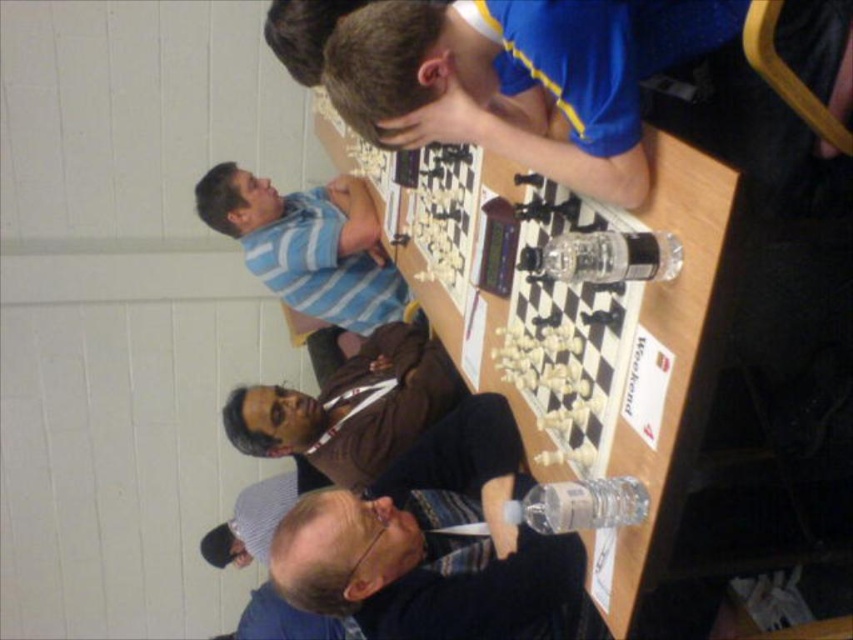
You are a photographer standing at the back of the room. You want to take a photo of the blue jersey at upper center and the blue striped shirt at upper left. The camera you are using has a minimum focus distance of 1.5 meters. Will you be able to capture both subjects clearly in the same frame without moving closer?

The distance between the blue jersey at upper center and the blue striped shirt at upper left is 1.42 meters. Since the minimum focus distance of your camera is 1.5 meters, you are slightly too far away to capture both subjects clearly in the same frame without moving closer.

You are a photographer positioned at the back of the room. You want to take a photo of the chessboard while ensuring both the blue jersey at upper center and the striped fabric shirt at lower center are visible. Which object is closer to the camera, and will this setup allow both to be in focus?

The blue jersey at upper center is closer to the camera than the striped fabric shirt at lower center. Since the two objects are at different distances, the photographer should ensure the camera is focused on the farther object to keep both in focus, but depth of field will determine if both are sharp. However, based on the description, the blue jersey is closer, so adjusting focus accordingly may be needed.